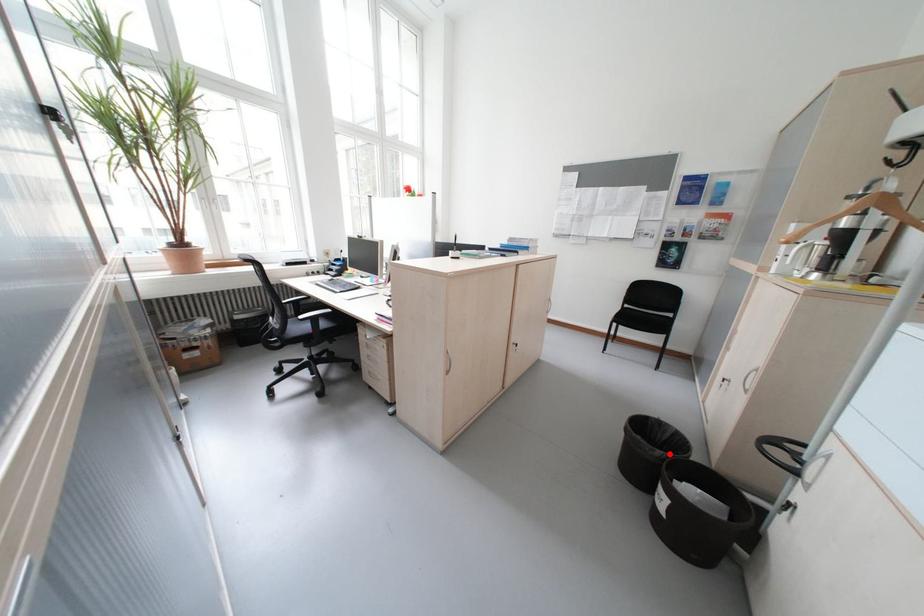
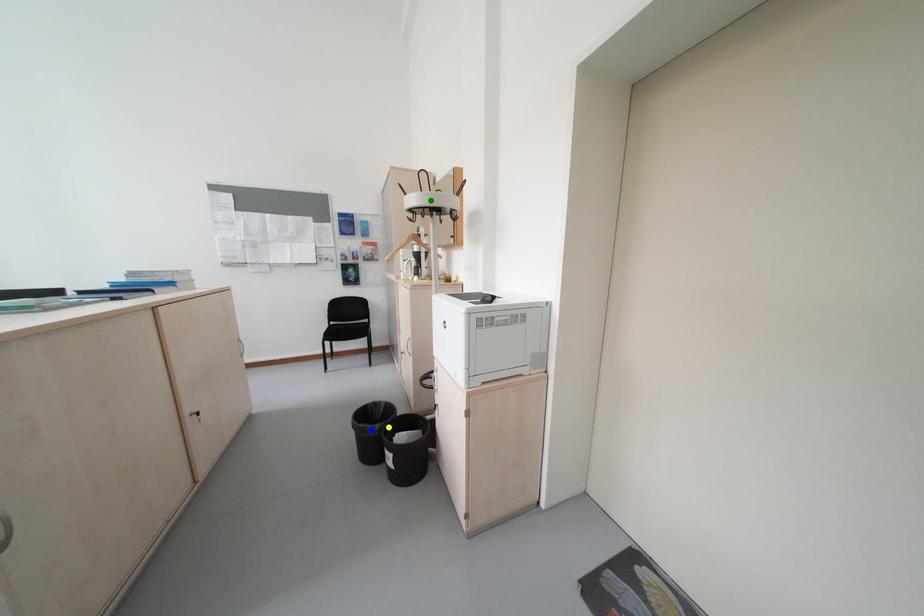
Question: I am providing you with two images of the same scene from different viewpoints. A red point is marked on the first image. You are given multiple points on the second image. Can you choose the point in image 2 that corresponds to the point in image 1?

Choices:
 (A) green point
 (B) yellow point
 (C) blue point

Answer: (B)